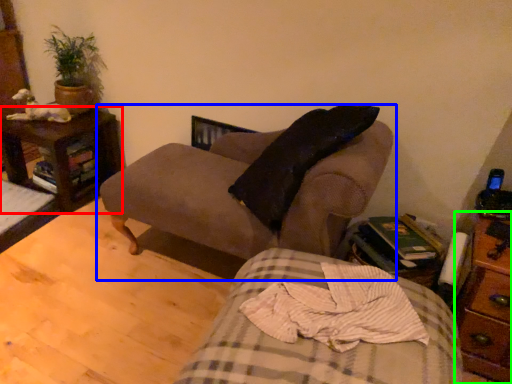
Question: Which object is positioned farthest from nightstand (highlighted by a red box)? Select from studio couch (highlighted by a blue box) and nightstand (highlighted by a green box).

Choices:
 (A) studio couch
 (B) nightstand

Answer: (B)